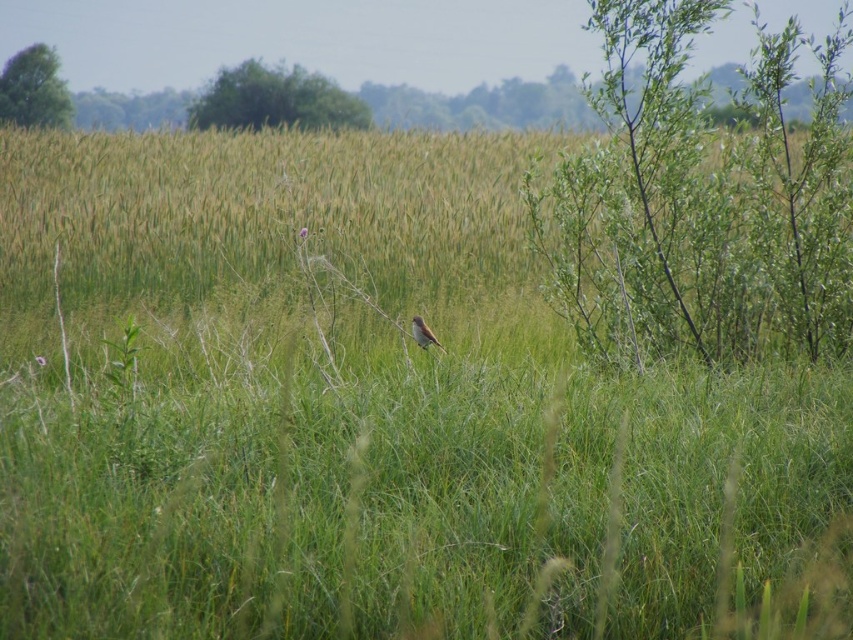
Question: Considering the relative positions of green leafy plant at right and brown feathered bird at center in the image provided, where is green leafy plant at right located with respect to brown feathered bird at center?

Choices:
 (A) left
 (B) right

Answer: (B)

Question: Can you confirm if green leafy plant at right is thinner than brown feathered bird at center?

Choices:
 (A) no
 (B) yes

Answer: (A)

Question: Which object is farther from the camera taking this photo?

Choices:
 (A) brown feathered bird at center
 (B) green grassy wheat field at center

Answer: (B)

Question: Is green grassy wheat field at center smaller than green leafy plant at right?

Choices:
 (A) no
 (B) yes

Answer: (B)

Question: Which object is farther from the camera taking this photo?

Choices:
 (A) green grassy wheat field at center
 (B) green leafy plant at right

Answer: (A)

Question: Which object is farther from the camera taking this photo?

Choices:
 (A) brown feathered bird at center
 (B) green leafy plant at right

Answer: (A)